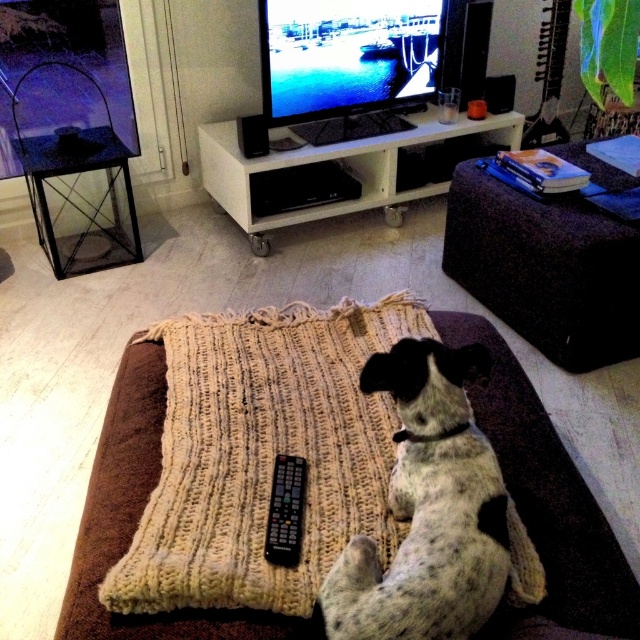
Is the position of purple fabric at upper right less distant than that of black plastic remote at center?

No, purple fabric at upper right is further to the viewer.

Can you confirm if purple fabric at upper right is positioned to the right of black plastic remote at center?

Correct, you'll find purple fabric at upper right to the right of black plastic remote at center.

Between point (467, 280) and point (280, 513), which one is positioned in front?

Point (280, 513) is more forward.

Where is `purple fabric at upper right`? purple fabric at upper right is located at coordinates (547, 268).

Is purple fabric at upper right smaller than white glossy entertainment center at center?

Yes, purple fabric at upper right is smaller than white glossy entertainment center at center.

How much distance is there between purple fabric at upper right and white glossy entertainment center at center?

30.83 inches

Is point (624, 339) farther from camera compared to point (320, 209)?

That is False.

At what (x,y) coordinates should I click in order to perform the action: click on purple fabric at upper right. Please return your answer as a coordinate pair (x, y). Looking at the image, I should click on (547, 268).

Is beige knitted blanket at center above purple fabric at upper right?

No.

What do you see at coordinates (550, 496) in the screenshot? The width and height of the screenshot is (640, 640). I see `beige knitted blanket at center` at bounding box center [550, 496].

Between point (148, 416) and point (566, 225), which one is positioned behind?

The point (566, 225) is more distant.

This screenshot has height=640, width=640. In order to click on beige knitted blanket at center in this screenshot , I will do click(x=550, y=496).